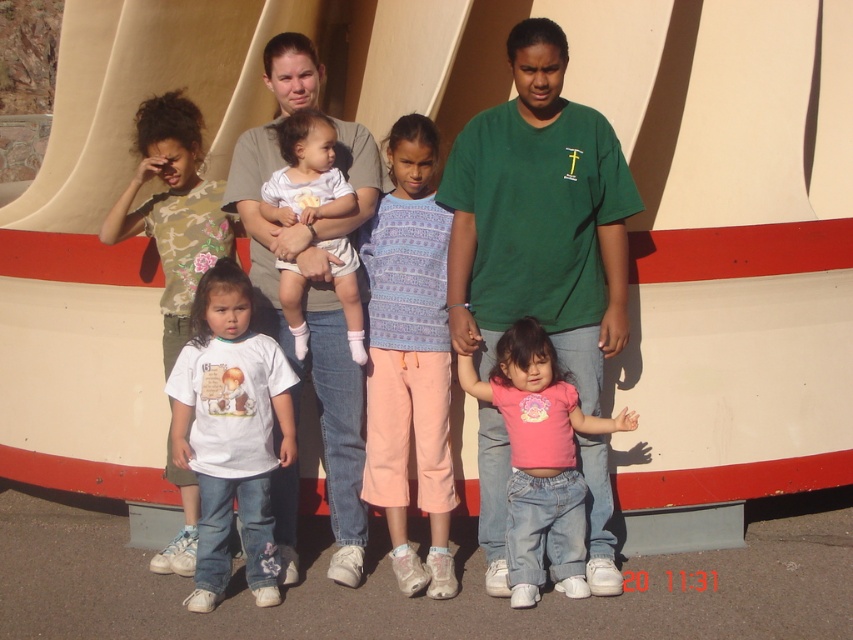
Question: Is matte gray shirt at center above pink cotton shirt at center?

Choices:
 (A) yes
 (B) no

Answer: (A)

Question: Can you confirm if green cotton shirt at center is positioned to the right of matte gray shirt at center?

Choices:
 (A) yes
 (B) no

Answer: (A)

Question: Which object is farther from the camera taking this photo?

Choices:
 (A) matte gray shirt at center
 (B) white cotton shirt at center
 (C) pink cotton shirt at center

Answer: (A)

Question: Does white cotton shirt at center appear over pink cotton shirt at center?

Choices:
 (A) no
 (B) yes

Answer: (B)

Question: Estimate the real-world distances between objects in this image. Which object is closer to the white cotton shirt at center?

Choices:
 (A) matte gray shirt at center
 (B) white cotton onesie at center
 (C) green cotton shirt at center
 (D) pink cotton shirt at center

Answer: (A)

Question: Which of the following is the closest to the observer?

Choices:
 (A) white cotton onesie at center
 (B) matte gray shirt at center
 (C) purple knit sweater at center
 (D) pink cotton shirt at center

Answer: (D)